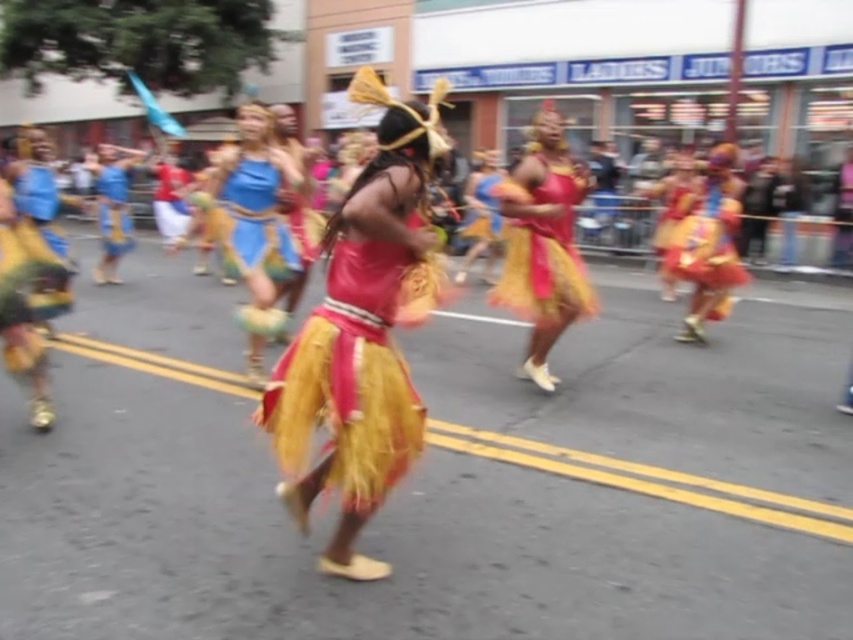
From the picture: You are standing in the street and see the point marked at coordinates (236,195). If you want to throw a flower bouquet to that point, and your throwing range is 5 meters, will you be able to reach it?

The point at (236,195) is 4.82 meters away from you, so yes, you can reach it with your 5 meter throwing range.